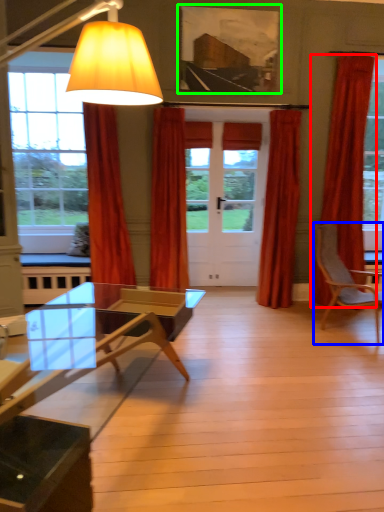
Question: Which is nearer to the curtain (highlighted by a red box)? chair (highlighted by a blue box) or picture frame (highlighted by a green box).

Choices:
 (A) chair
 (B) picture frame

Answer: (A)